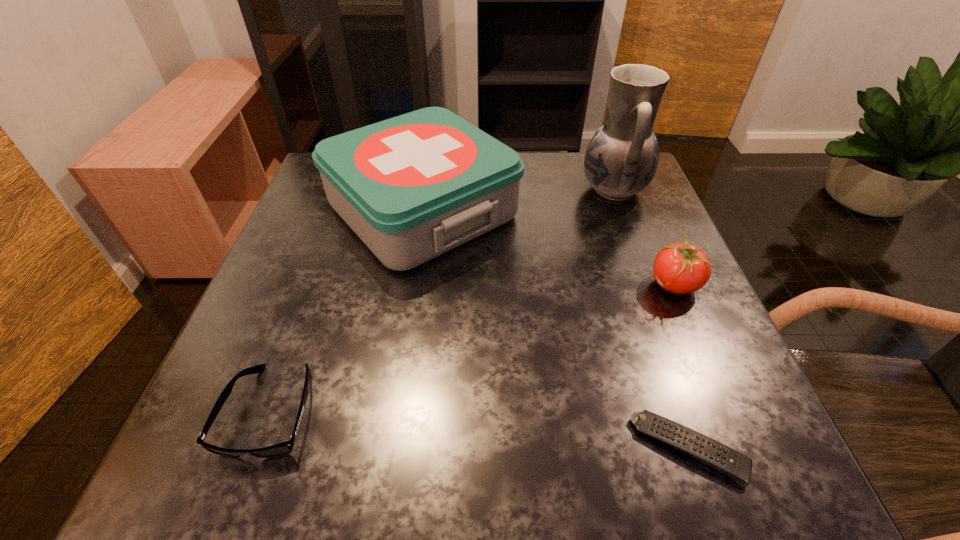
The width and height of the screenshot is (960, 540). Identify the location of object located in the far left corner section of the desktop. (412, 187).

This screenshot has width=960, height=540. What are the coordinates of `object positioned at the near left corner` in the screenshot? It's located at click(x=284, y=448).

Locate an element on the screen. The height and width of the screenshot is (540, 960). object located in the far right corner section of the desktop is located at coordinates (621, 159).

Where is `object positioned at the near right corner`? The height and width of the screenshot is (540, 960). object positioned at the near right corner is located at coordinates (726, 460).

The height and width of the screenshot is (540, 960). In order to click on free spot at the far edge of the desktop in this screenshot , I will do `click(553, 157)`.

You are a GUI agent. You are given a task and a screenshot of the screen. Output one action in this format:
    pyautogui.click(x=<x>, y=<y>)
    Task: Click on the vacant space at the near edge of the desktop
    
    Given the screenshot: What is the action you would take?
    pyautogui.click(x=495, y=476)

This screenshot has height=540, width=960. What are the coordinates of `vacant point at the left edge` in the screenshot? It's located at (335, 282).

Where is `blank area at the right edge`? Image resolution: width=960 pixels, height=540 pixels. blank area at the right edge is located at coordinates (636, 255).

In the image, there is a desktop. Identify the location of vacant region at the near left corner. (229, 436).

The height and width of the screenshot is (540, 960). What are the coordinates of `blank space at the far right corner of the desktop` in the screenshot? It's located at (579, 161).